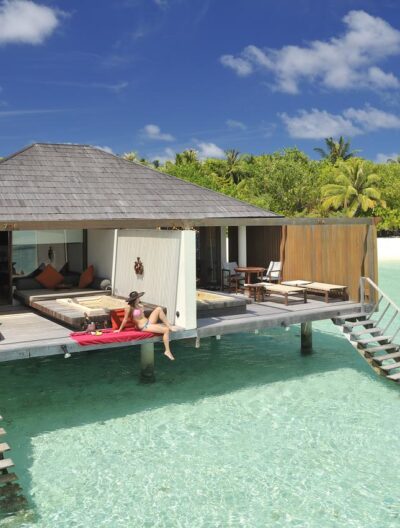
I want to click on divider, so 173,276.